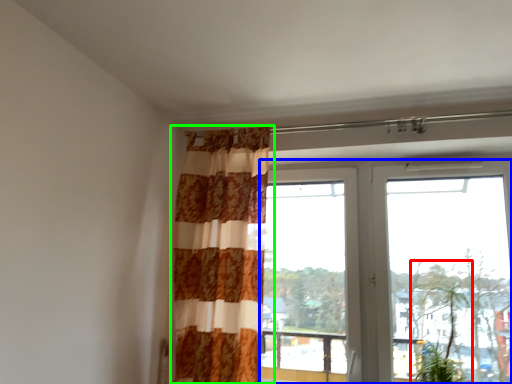
Question: Estimate the real-world distances between objects in this image. Which object is farther from plant (highlighted by a red box), window (highlighted by a blue box) or curtain (highlighted by a green box)?

Choices:
 (A) window
 (B) curtain

Answer: (B)